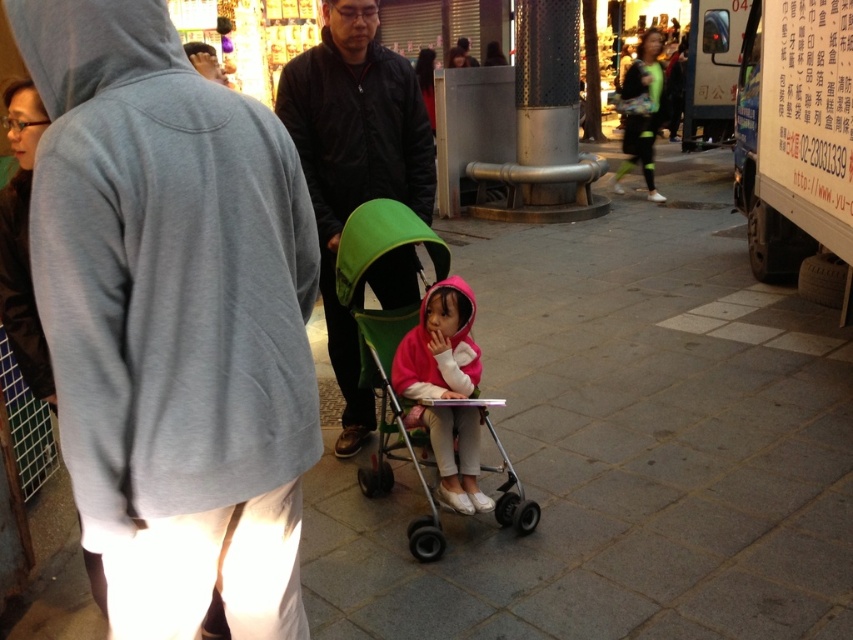
You are a photographer trying to capture a photo of the pink fleece jacket at center and the green mesh leggings at right. Which object should you zoom in on to make them appear the same size in the photo?

To make the pink fleece jacket at center and the green mesh leggings at right appear the same size in the photo, you should zoom in on the pink fleece jacket at center because it is smaller than the green mesh leggings at right.

You are standing in the middle of the street and see two points in the scene. The first point is at coordinates point (494, 436) and the second point is at point (432, 74). Which point is closer to you?

Point (494, 436) is closer to the viewer than point (432, 74).

You are a photographer trying to capture a clear shot of the green mesh leggings at right and the matte black jacket at center. Based on their positions and sizes, which object should you focus on first to ensure both are in frame without moving the camera?

The green mesh leggings at right might be wider than matte black jacket at center, so you should focus on the green mesh leggings at right first to ensure both fit within the camera frame.